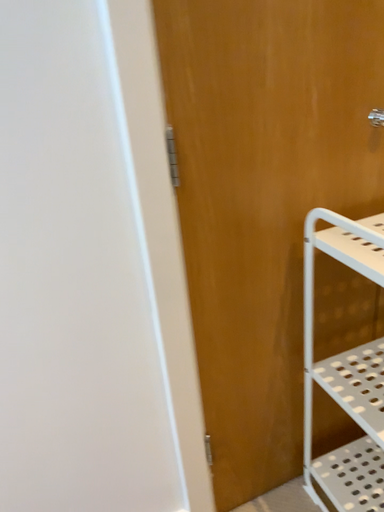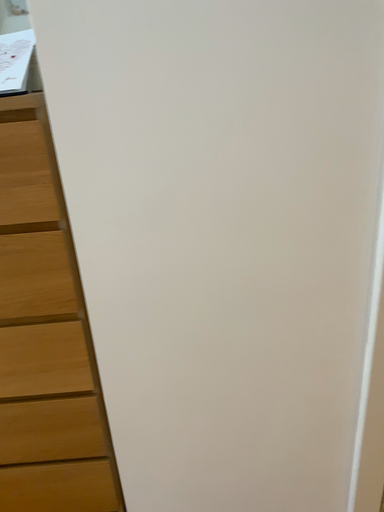
Question: Which way did the camera rotate in the video?

Choices:
 (A) rotated right
 (B) rotated left

Answer: (B)